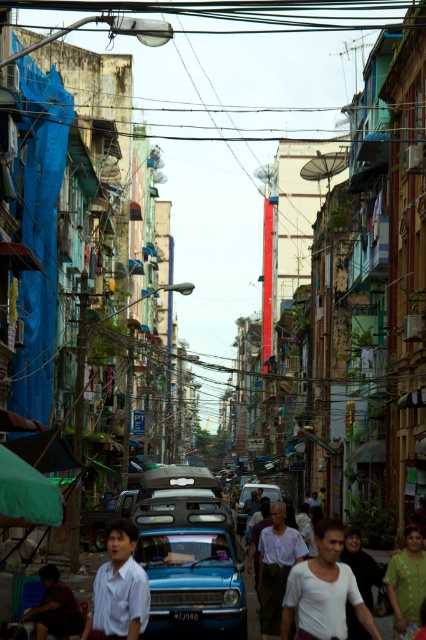
Question: Which is farther from the blue metallic car at center?

Choices:
 (A) brown fabric shirt at lower left
 (B) white shirt at lower left

Answer: (A)

Question: In this image, where is white matte shirt at center located relative to white shirt at lower left?

Choices:
 (A) right
 (B) left

Answer: (A)

Question: Is light brown fabric shirt at center in front of brown fabric shirt at lower left?

Choices:
 (A) no
 (B) yes

Answer: (B)

Question: Which object is farther from the camera taking this photo?

Choices:
 (A) blue matte car at center
 (B) white shirt at lower left
 (C) blue metallic car at center

Answer: (A)

Question: From the image, what is the correct spatial relationship of green fabric dress at lower right in relation to blue matte car at center?

Choices:
 (A) above
 (B) below

Answer: (A)

Question: Which point is farther from the camera taking this photo?

Choices:
 (A) click(x=236, y=531)
 (B) click(x=408, y=544)
 (C) click(x=209, y=621)

Answer: (A)